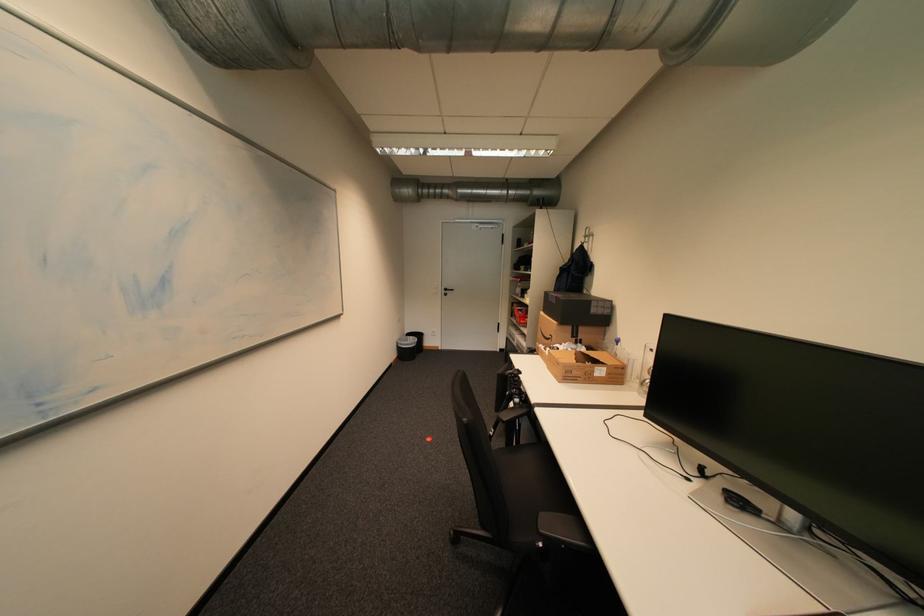
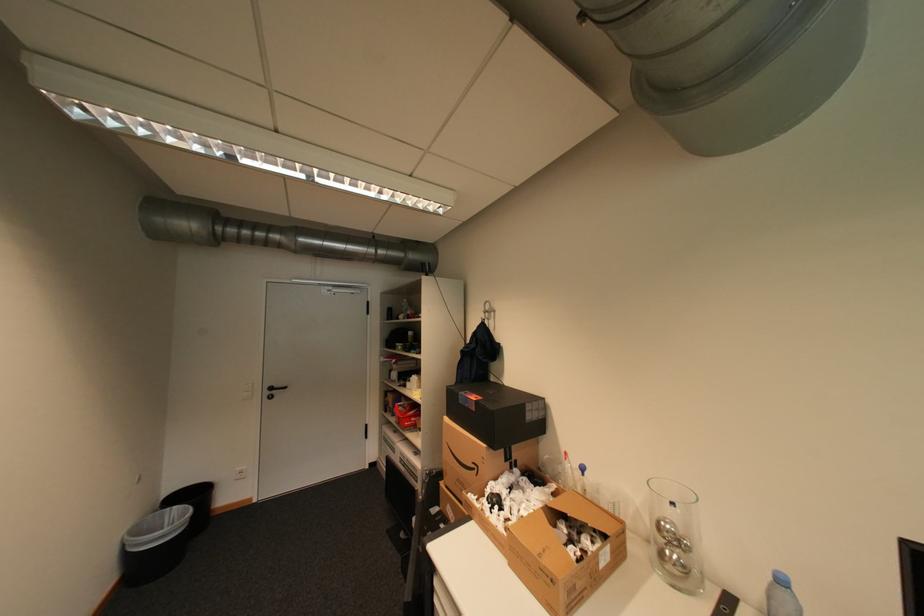
Find the pixel in the second image that matches [406,339] in the first image.

(132, 531)